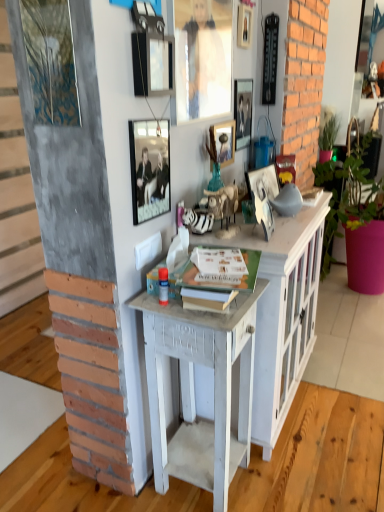
Locate an element on the screen. Image resolution: width=384 pixels, height=512 pixels. free space above green matte book at center (from a real-world perspective) is located at coordinates (222, 261).